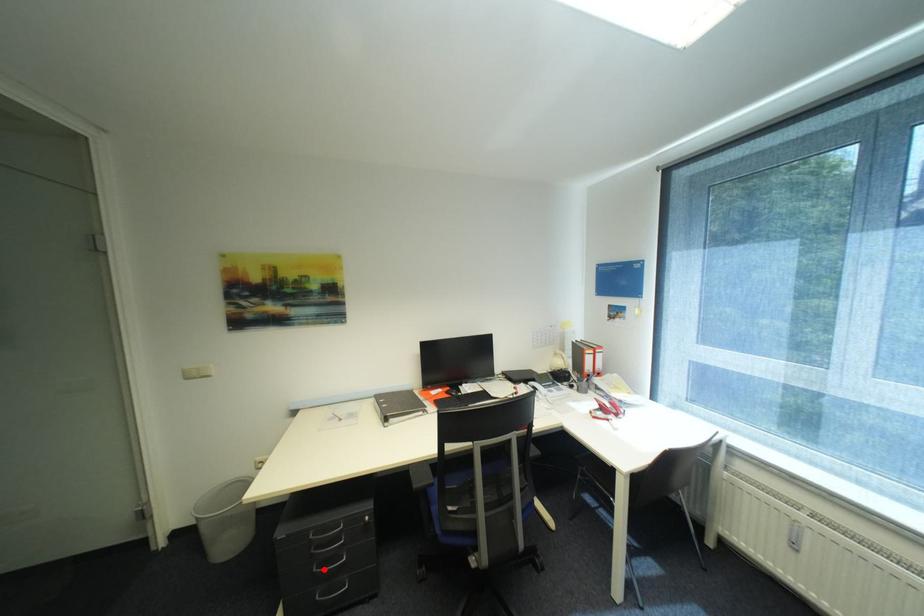
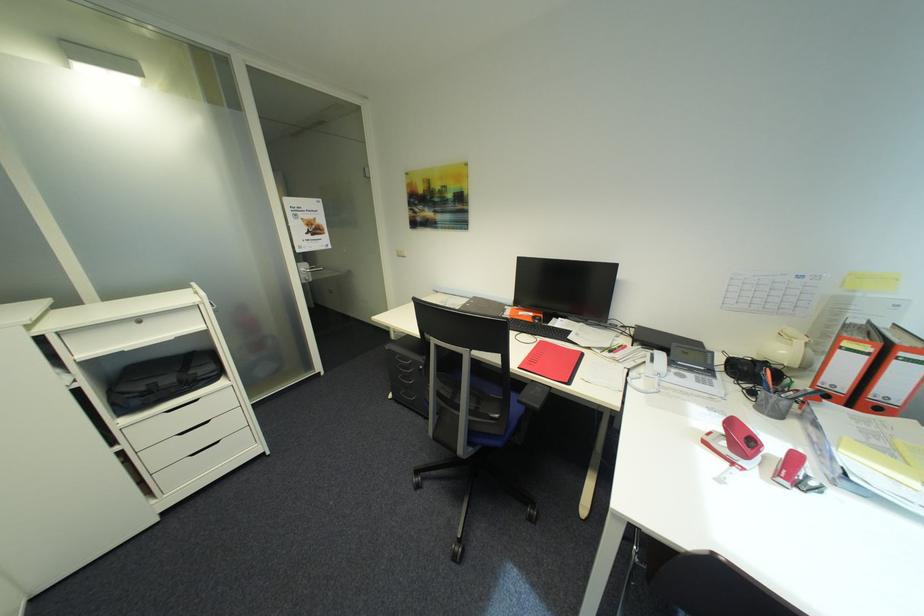
Question: I am providing you with two images of the same scene from different viewpoints. In image1, a red point is highlighted. Considering the same 3D point in image2, which of the following is correct?

Choices:
 (A) It is closer
 (B) It is farther

Answer: (B)